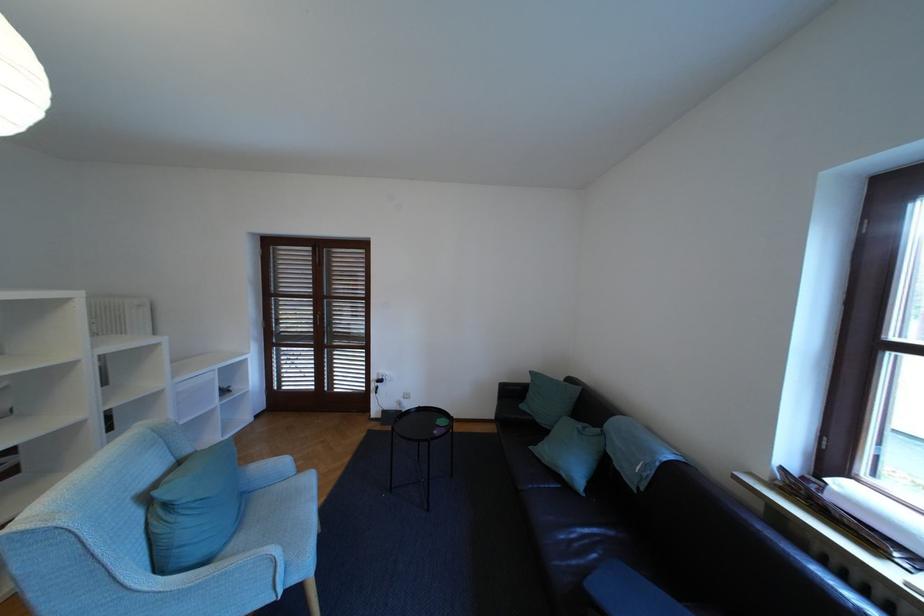
Locate an element on the screen. light blue chair sitting surface is located at coordinates (287, 516).